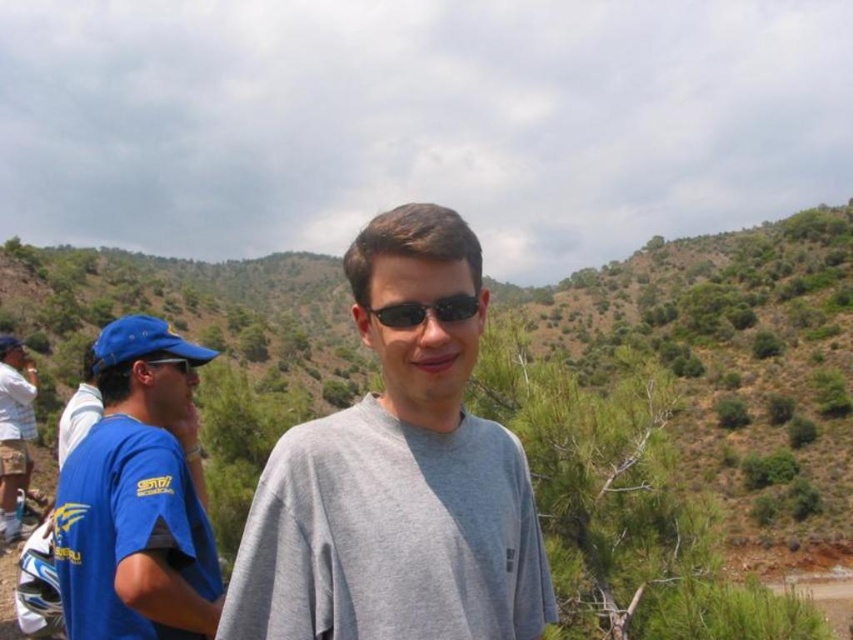
You are a photographer trying to capture a closeup of the gray matte shirt at center. You notice a point at coordinates (397, 477) in the frame. Where is this point located in relation to the gray matte shirt at center?

The point at coordinates (397, 477) is located on the gray matte shirt at center.

You are a photographer trying to capture a group photo. You notice the blue fabric cap at left and the white cotton shirt at left are partially blocking the view. Which object should you adjust to ensure the background is visible?

The blue fabric cap at left is shorter than the white cotton shirt at left, so adjusting the white cotton shirt at left would better ensure the background is visible by lowering it or moving it out of the way.